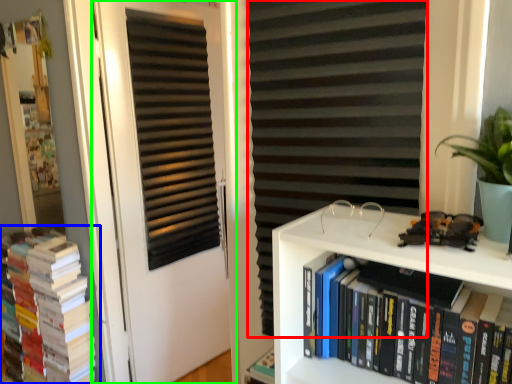
Question: Which object is positioned closest to curtain (highlighted by a red box)? Select from book (highlighted by a blue box) and door (highlighted by a green box).

Choices:
 (A) book
 (B) door

Answer: (B)